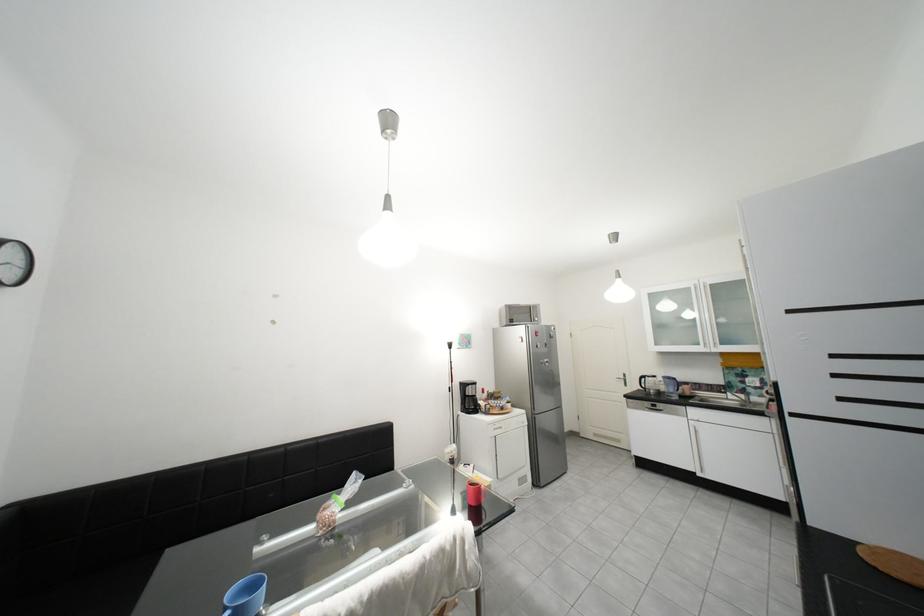
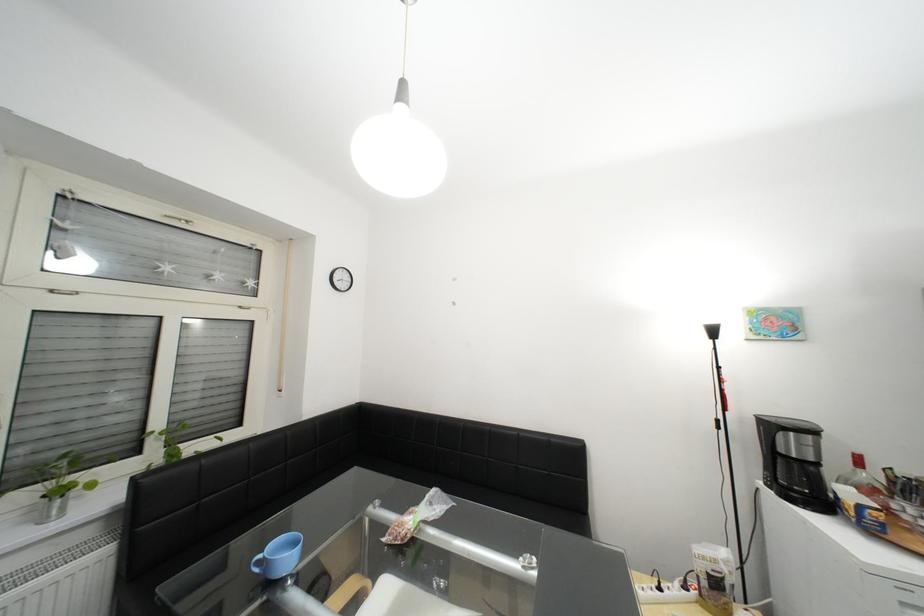
Find the pixel in the second image that matches pixel 476 387 in the first image.

(782, 428)